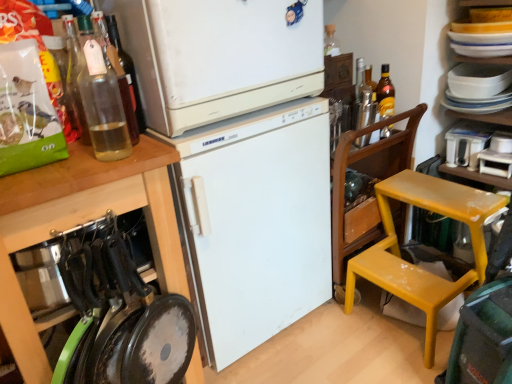
Question: Is white matte refrigerator at upper center, placed as the second refrigerator when sorted from bottom to top, closer to the viewer compared to white matte cabinet at left?

Choices:
 (A) no
 (B) yes

Answer: (A)

Question: Does white matte refrigerator at upper center, arranged as the 1th refrigerator when viewed from the top, appear on the left side of white matte cabinet at left?

Choices:
 (A) yes
 (B) no

Answer: (B)

Question: Is white matte refrigerator at upper center, placed as the second refrigerator when sorted from bottom to top, located outside white matte cabinet at left?

Choices:
 (A) yes
 (B) no

Answer: (A)

Question: Does white matte refrigerator at upper center, arranged as the 1th refrigerator when viewed from the top, come behind white matte cabinet at left?

Choices:
 (A) yes
 (B) no

Answer: (A)

Question: Considering the relative sizes of white matte refrigerator at upper center, placed as the second refrigerator when sorted from bottom to top, and white matte cabinet at left in the image provided, is white matte refrigerator at upper center, placed as the second refrigerator when sorted from bottom to top, thinner than white matte cabinet at left?

Choices:
 (A) no
 (B) yes

Answer: (B)

Question: Looking at their shapes, would you say translucent glass bottle at upper left, the second bottle from the left, is wider or thinner than white matte refrigerator at center, which appears as the first refrigerator when ordered from the bottom?

Choices:
 (A) wide
 (B) thin

Answer: (B)

Question: Is translucent glass bottle at upper left, the third bottle in the back-to-front sequence, taller or shorter than white matte refrigerator at center, which is the second refrigerator in top-to-bottom order?

Choices:
 (A) tall
 (B) short

Answer: (B)

Question: Is translucent glass bottle at upper left, marked as the third bottle in a right-to-left arrangement, to the left or to the right of white matte refrigerator at center, which appears as the first refrigerator when ordered from the bottom, in the image?

Choices:
 (A) right
 (B) left

Answer: (B)

Question: Considering the positions of point (115, 24) and point (258, 261), is point (115, 24) closer or farther from the camera than point (258, 261)?

Choices:
 (A) farther
 (B) closer

Answer: (B)

Question: In terms of height, does yellow plastic chair at right look taller or shorter compared to white matte refrigerator at center, which is the second refrigerator in top-to-bottom order?

Choices:
 (A) tall
 (B) short

Answer: (B)

Question: Considering their positions, is yellow plastic chair at right located in front of or behind white matte refrigerator at center, which is the second refrigerator in top-to-bottom order?

Choices:
 (A) front
 (B) behind

Answer: (B)

Question: From a real-world perspective, is yellow plastic chair at right above or below white matte refrigerator at center, which appears as the first refrigerator when ordered from the bottom?

Choices:
 (A) above
 (B) below

Answer: (B)

Question: Looking at the image, does yellow plastic chair at right seem bigger or smaller compared to white matte refrigerator at center, which is the second refrigerator in top-to-bottom order?

Choices:
 (A) small
 (B) big

Answer: (A)

Question: Would you say metallic silver shaker at upper right, positioned as the third bottle in left-to-right order, is to the left or to the right of white glossy bowls at upper right, arranged as the first appliance when viewed from the top, in the picture?

Choices:
 (A) left
 (B) right

Answer: (A)

Question: From a real-world perspective, is metallic silver shaker at upper right, the second bottle viewed from the right, above or below white glossy bowls at upper right, the 2th appliance ordered from the bottom?

Choices:
 (A) below
 (B) above

Answer: (A)